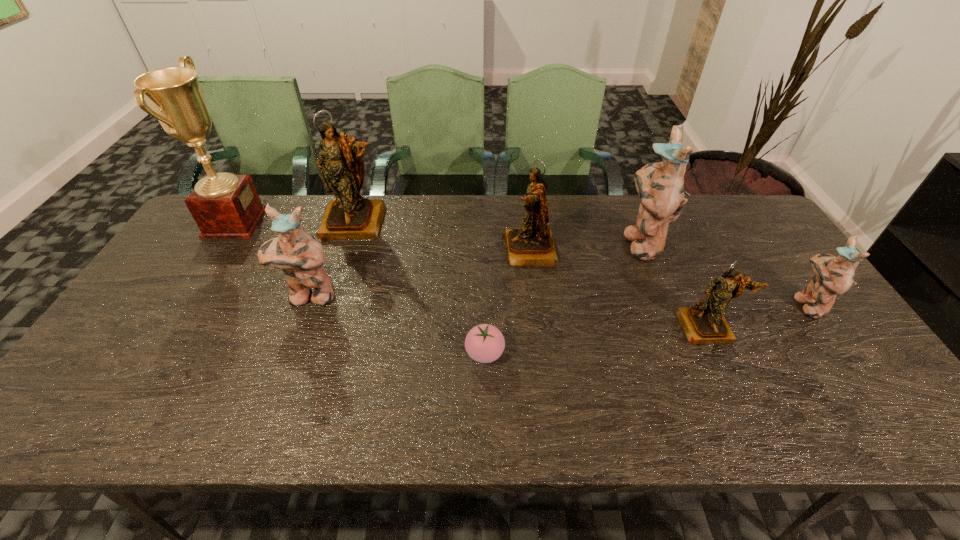
This screenshot has height=540, width=960. Find the location of `free space located on the front-facing side of the fourth object from right to left`. free space located on the front-facing side of the fourth object from right to left is located at coordinates (470, 251).

This screenshot has height=540, width=960. I want to click on vacant space situated on the front-facing side of the fourth object from right to left, so click(x=392, y=251).

This screenshot has width=960, height=540. In order to click on free spot located on the front-facing side of the leftmost pink figurine in this screenshot , I will do [x=293, y=343].

Identify the location of free spot located on the front-facing side of the rightmost pink figurine. The height and width of the screenshot is (540, 960). (761, 305).

The image size is (960, 540). What are the coordinates of `vacant area situated 0.100m on the front-facing side of the rightmost pink figurine` in the screenshot? It's located at (757, 305).

In order to click on blank space located 0.120m on the front-facing side of the rightmost pink figurine in this screenshot , I will do `click(750, 305)`.

Where is `vacant point located 0.160m on the front-facing side of the nearest gold figurine`? The height and width of the screenshot is (540, 960). vacant point located 0.160m on the front-facing side of the nearest gold figurine is located at coordinates (743, 405).

Identify the location of free space located 0.340m on the right of the shortest object. This screenshot has height=540, width=960. (643, 353).

Where is `trophy cup that is at the far edge`? trophy cup that is at the far edge is located at coordinates (224, 205).

Where is `object at the left edge`? object at the left edge is located at coordinates (224, 205).